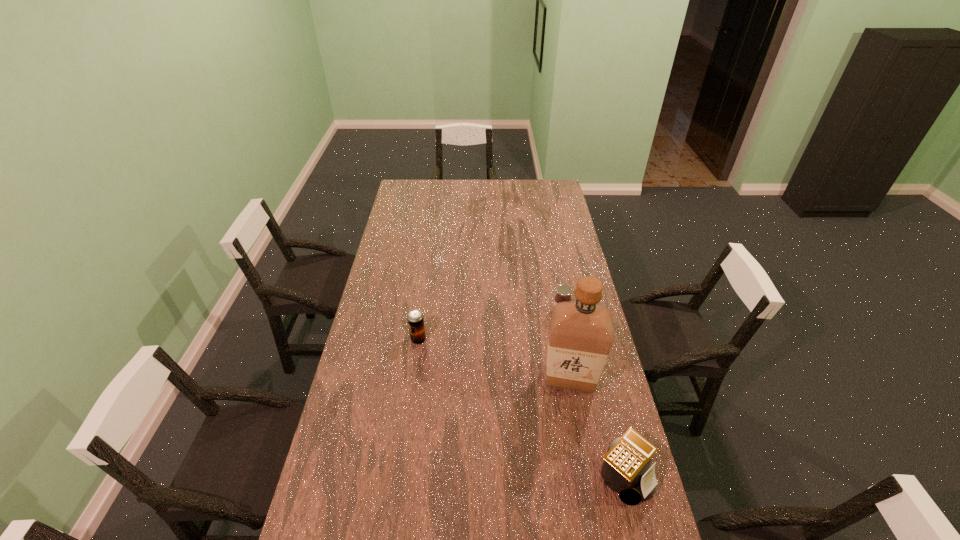
This screenshot has width=960, height=540. Identify the location of vacant space on the desktop that is between the third nearest object and the calculator and is positioned on the label side of the jam. (522, 409).

Locate an element on the screen. The width and height of the screenshot is (960, 540). vacant spot on the desktop that is between the second farthest object and the nearest object and is positioned on the front-facing side of the tallest object is located at coordinates (534, 416).